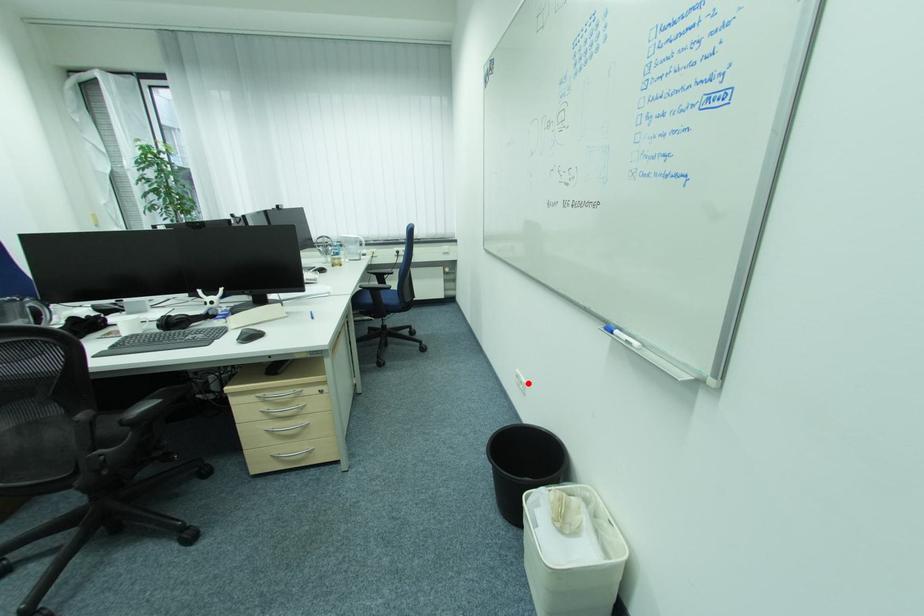
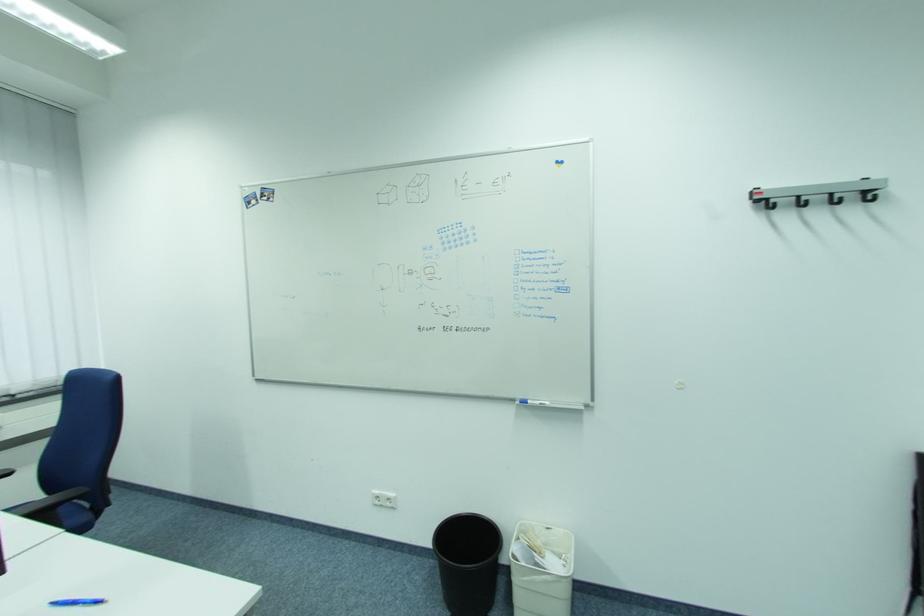
Where in the second image is the point corresponding to the highlighted location from the first image?

(395, 500)